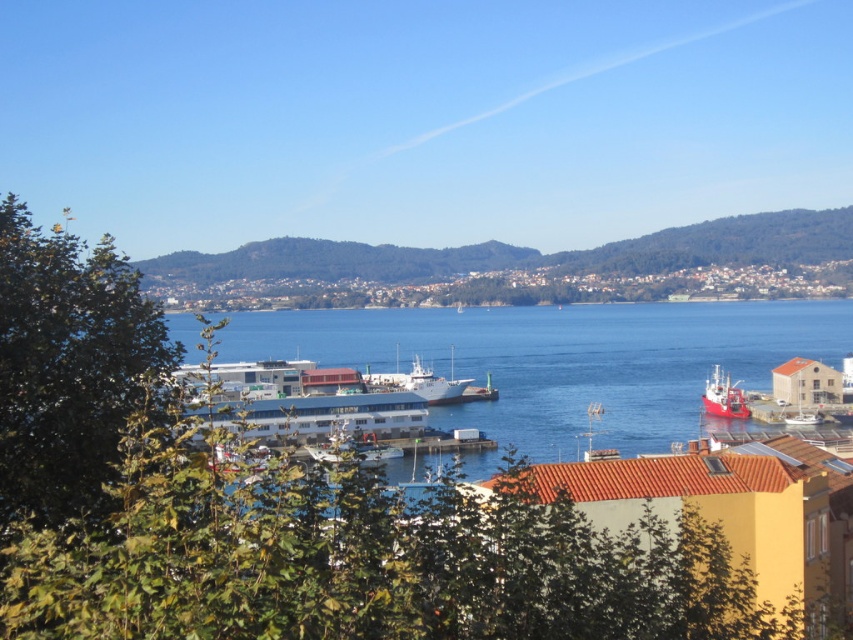
Is point (405, 420) positioned before point (715, 412)?

Yes, it is in front of point (715, 412).

Between point (248, 424) and point (715, 381), which one is positioned in front?

Point (248, 424)

You are a GUI agent. You are given a task and a screenshot of the screen. Output one action in this format:
    pyautogui.click(x=<x>, y=<y>)
    Task: Click on the white matte cruise ship at center
    The height and width of the screenshot is (640, 853).
    Given the screenshot: What is the action you would take?
    pyautogui.click(x=320, y=417)

Does point (418, 417) lie behind point (387, 385)?

No, it is not.

Does white matte cruise ship at center come in front of white matte ship at center?

Yes, white matte cruise ship at center is closer to the viewer.

What do you see at coordinates (320, 417) in the screenshot?
I see `white matte cruise ship at center` at bounding box center [320, 417].

Where is `white matte cruise ship at center`? Image resolution: width=853 pixels, height=640 pixels. white matte cruise ship at center is located at coordinates (320, 417).

Who is lower down, blue water at center or white matte ship at center?

Positioned lower is white matte ship at center.

Between blue water at center and white matte ship at center, which one has more height?

Standing taller between the two is blue water at center.

Is point (315, 353) closer to viewer compared to point (419, 368)?

No, (315, 353) is further to viewer.

At what (x,y) coordinates should I click in order to perform the action: click on blue water at center. Please return your answer as a coordinate pair (x, y). The height and width of the screenshot is (640, 853). Looking at the image, I should click on (563, 360).